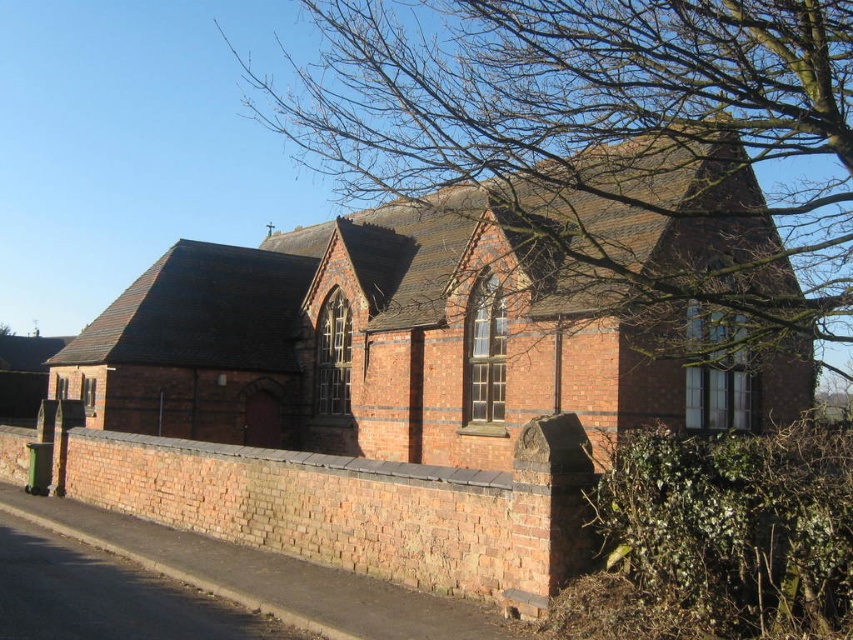
Question: Which point is farther to the camera?

Choices:
 (A) bare branches at upper center
 (B) red brick church at center

Answer: (A)

Question: From the image, what is the correct spatial relationship of red brick church at center in relation to bare branches at upper center?

Choices:
 (A) below
 (B) above

Answer: (A)

Question: Can you confirm if red brick church at center is thinner than bare branches at upper center?

Choices:
 (A) no
 (B) yes

Answer: (B)

Question: Can you confirm if red brick church at center is bigger than bare branches at upper center?

Choices:
 (A) no
 (B) yes

Answer: (A)

Question: Among these objects, which one is farthest from the camera?

Choices:
 (A) red brick church at center
 (B) bare branches at upper center

Answer: (B)

Question: Among these objects, which one is nearest to the camera?

Choices:
 (A) red brick church at center
 (B) bare branches at upper center

Answer: (A)